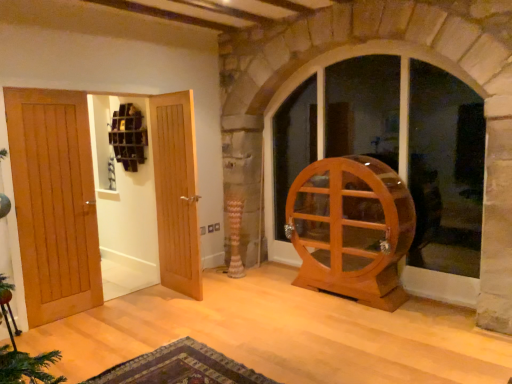
You are a GUI agent. You are given a task and a screenshot of the screen. Output one action in this format:
    pyautogui.click(x=<x>, y=<y>)
    Task: Click on the free spot in front of light brown wood hamster wheel at right
    This screenshot has height=384, width=512.
    Given the screenshot: What is the action you would take?
    click(x=364, y=328)